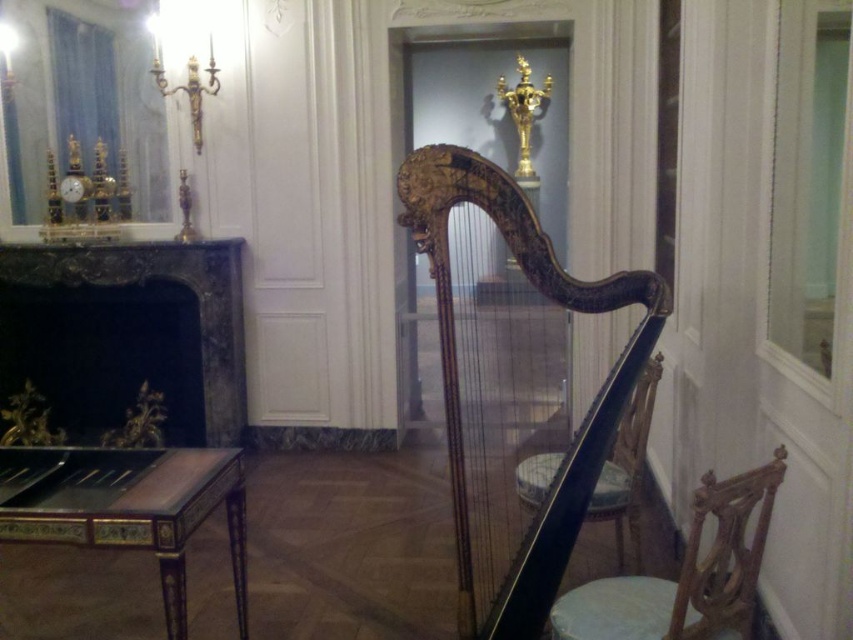
Question: Which point is farther to the camera?

Choices:
 (A) wooden chair at center
 (B) glossy wood harp at center
 (C) wooden chair at lower right
 (D) smooth white stool at lower right

Answer: (A)

Question: Does wooden chair at center have a greater width compared to smooth white stool at lower right?

Choices:
 (A) yes
 (B) no

Answer: (A)

Question: Which of these objects is positioned closest to the wooden chair at lower right?

Choices:
 (A) glossy wood harp at center
 (B) wooden chair at center
 (C) black marble fireplace at left

Answer: (A)

Question: Does black marble fireplace at left appear over smooth white stool at lower right?

Choices:
 (A) yes
 (B) no

Answer: (A)

Question: Can you confirm if wooden chair at lower right is thinner than wooden chair at center?

Choices:
 (A) yes
 (B) no

Answer: (A)

Question: Which point is closer to the camera taking this photo?

Choices:
 (A) (608, 474)
 (B) (735, 525)
 (C) (468, 561)

Answer: (B)